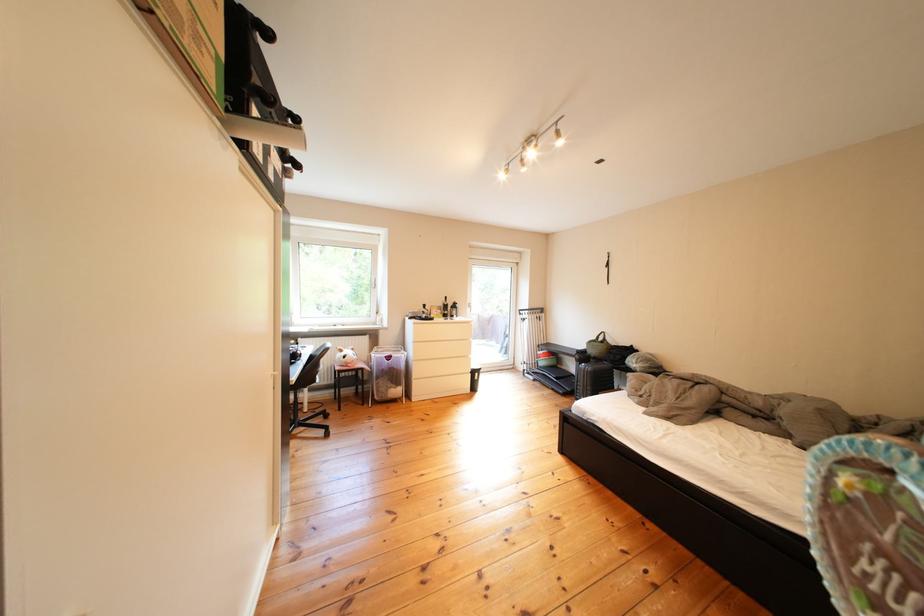
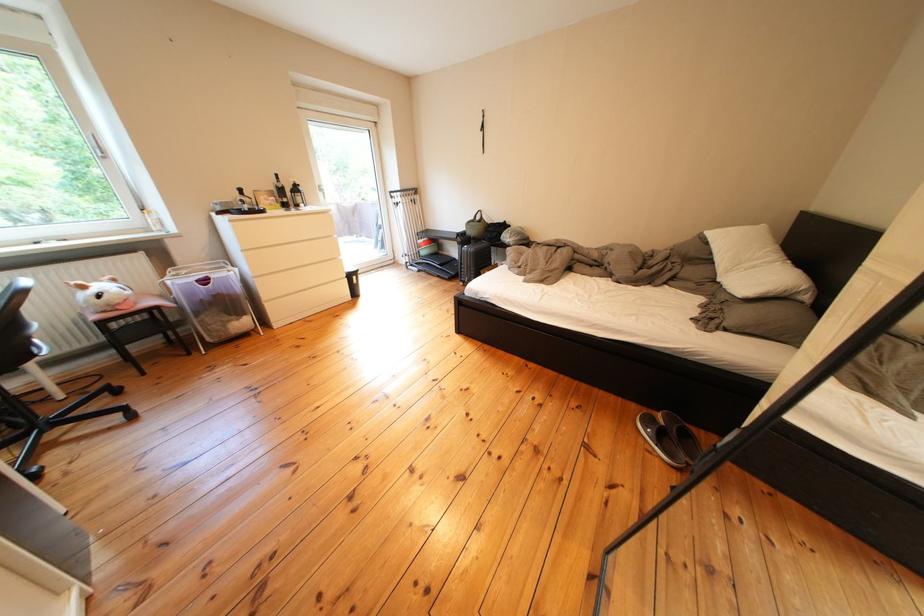
The first image is from the beginning of the video and the second image is from the end. How did the camera likely rotate when shooting the video?

The rotation direction of the camera is right-down.